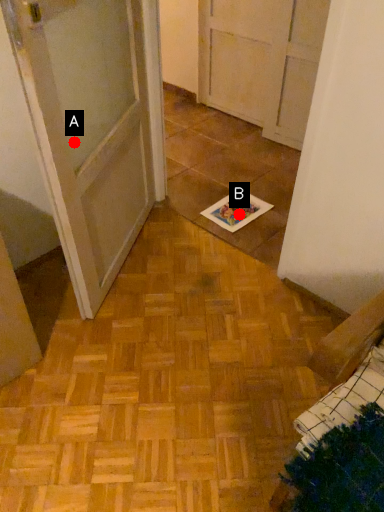
Question: Two points are circled on the image, labeled by A and B beside each circle. Among these points, which one is nearest to the camera?

Choices:
 (A) A is closer
 (B) B is closer

Answer: (A)